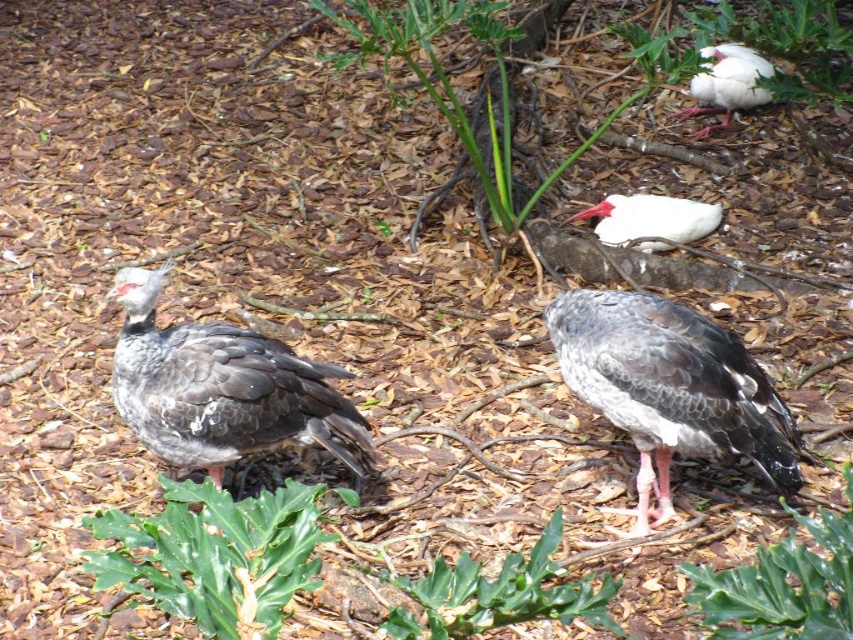
Question: Can you confirm if white matte beak at upper right is bigger than white matte bird at upper right?

Choices:
 (A) no
 (B) yes

Answer: (A)

Question: Which of the following is the closest to the observer?

Choices:
 (A) (236, 449)
 (B) (733, 108)
 (C) (572, 332)

Answer: (C)

Question: Estimate the real-world distances between objects in this image. Which object is farther from the dark gray feathers at center?

Choices:
 (A) gray matte bird at center
 (B) white matte beak at upper right
 (C) white matte bird at upper right

Answer: (C)

Question: Which point appears closest to the camera in this image?

Choices:
 (A) (184, 435)
 (B) (735, 88)
 (C) (672, 218)

Answer: (A)

Question: Can you confirm if gray matte bird at center is positioned below white matte bird at upper right?

Choices:
 (A) no
 (B) yes

Answer: (B)

Question: Is gray matte bird at center behind white matte beak at upper right?

Choices:
 (A) yes
 (B) no

Answer: (B)